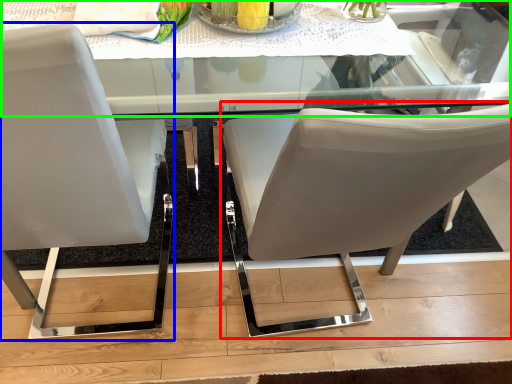
Question: Which object is positioned closest to chair (highlighted by a red box)? Select from chair (highlighted by a blue box) and round table (highlighted by a green box).

Choices:
 (A) chair
 (B) round table

Answer: (A)